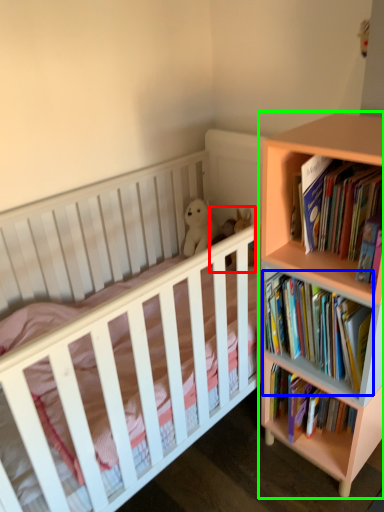
Question: Which is farther away from toy (highlighted by a red box)? book (highlighted by a blue box) or bookcase (highlighted by a green box)?

Choices:
 (A) book
 (B) bookcase

Answer: (B)